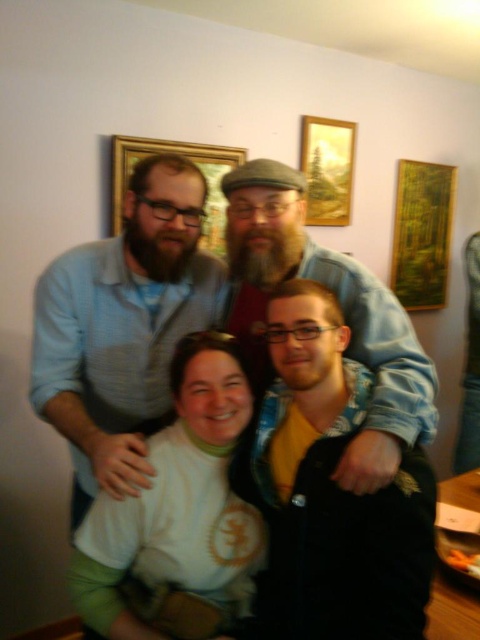
You are standing in front of the image and want to touch the black matte jacket at center and the wooden frame at upper center. Which object will you reach first?

The black matte jacket at center is closer to the viewer than the wooden frame at upper center, so you will reach the black matte jacket at center first.

You are an interior designer assessing the layout of this room. The matte blue shirt at center and the wooden frame at upper center are both in the same general area. Which object is closer to the ceiling?

The wooden frame at upper center is closer to the ceiling because it is positioned above the matte blue shirt at center.